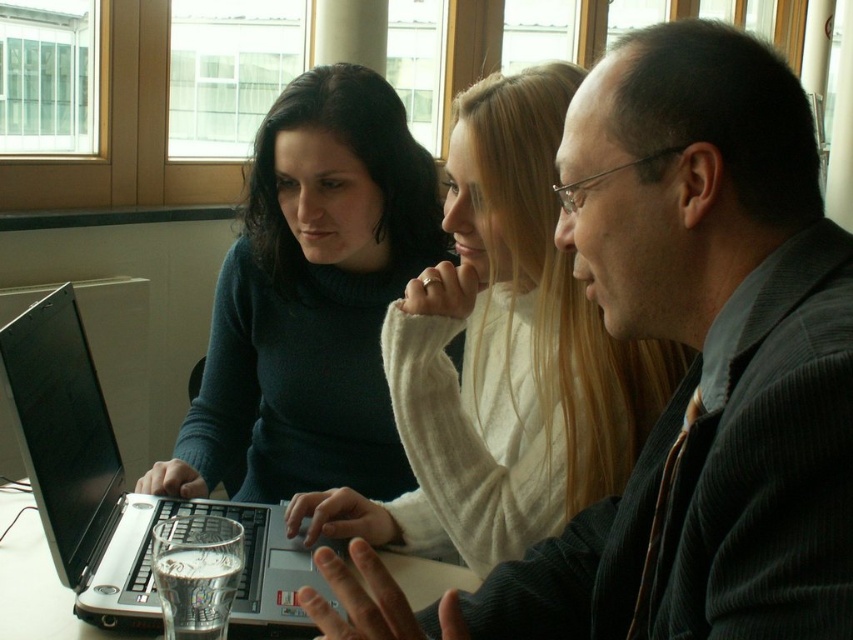
You are a tailor measuring two suits in a fitting room. You have the dark gray suit at center and the matte blue sweater at center. Which one has a longer length?

The matte blue sweater at center is longer than the dark gray suit at center.

You are a photographer trying to capture a group photo of the dark gray suit at center and the matte blue sweater at center. You want to ensure there is at least 24 inches between them in the photo. Based on the scene, will this requirement be met?

The dark gray suit at center and the matte blue sweater at center are 26.61 inches apart from each other, which is more than the required 24 inches. Therefore, the requirement will be met.

You are standing in the room and want to place a new object at the same location as the dark gray suit at center. What coordinates should you use?

You should use the coordinates point (x=688, y=371) to place the new object at the same location as the dark gray suit at center.